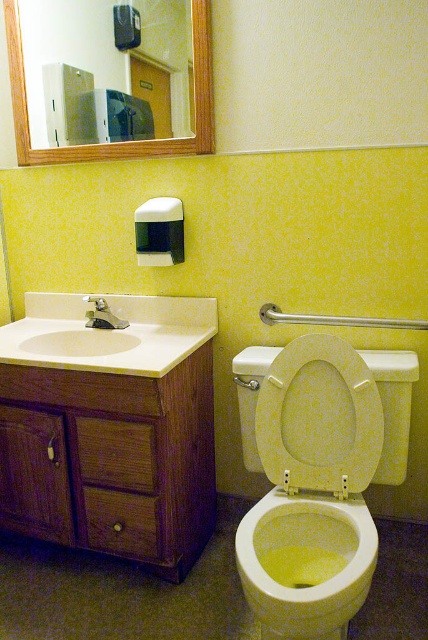
You are standing in the bathroom and need to reach the yellow matte toilet bowl at center. Based on its coordinates, is it positioned closer to the left or right wall?

The yellow matte toilet bowl at center is located at point 0.880 on the x and 0.715 on the y, which places it closer to the right wall since the x coordinate is closer to 1.0. However, the description mentions it is to the right of the vanity, so it is positioned closer to the right wall.

You are standing in the bathroom and want to reach both points mentioned. Which point, point (285,580) or point (318,464), is closer to you?

Point (285,580) is closer to you than point (318,464).